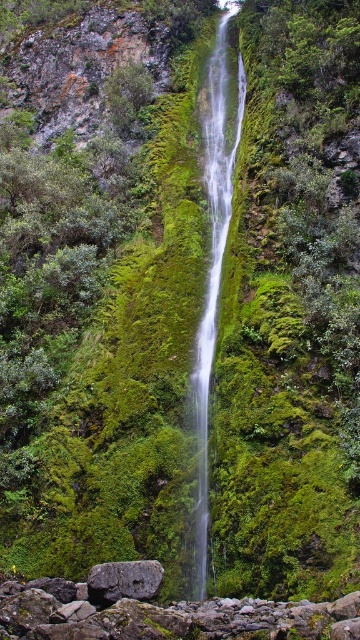
Question: Which point appears farthest from the camera in this image?

Choices:
 (A) (87, 582)
 (B) (204, 168)

Answer: (B)

Question: Is clear glass waterfall at center below gray rough rock at lower center?

Choices:
 (A) no
 (B) yes

Answer: (A)

Question: Does clear glass waterfall at center have a greater width compared to gray rough rock at lower center?

Choices:
 (A) yes
 (B) no

Answer: (A)

Question: Can you confirm if clear glass waterfall at center is positioned to the left of gray rough rock at lower center?

Choices:
 (A) no
 (B) yes

Answer: (A)